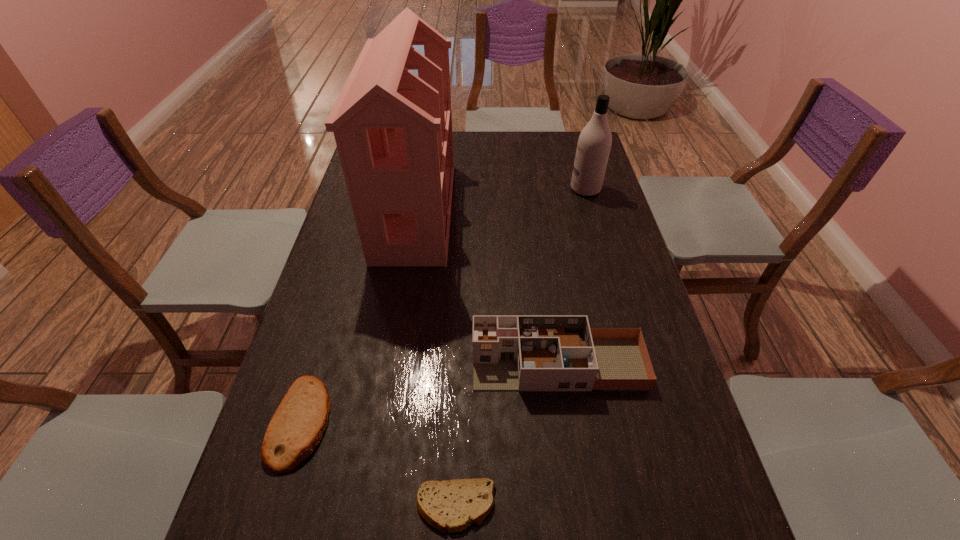
I want to click on shampoo at the right edge, so click(594, 143).

You are a GUI agent. You are given a task and a screenshot of the screen. Output one action in this format:
    pyautogui.click(x=<x>, y=<y>)
    Task: Click on the dollhouse that is at the right edge
    This screenshot has width=960, height=540.
    Given the screenshot: What is the action you would take?
    pyautogui.click(x=510, y=352)

Find the location of a particular element. This screenshot has height=540, width=960. vacant space at the left edge of the desktop is located at coordinates (327, 484).

This screenshot has width=960, height=540. Find the location of `free space at the right edge of the desktop`. free space at the right edge of the desktop is located at coordinates (646, 343).

Image resolution: width=960 pixels, height=540 pixels. Find the location of `vacant space that is in between the nearer dollhouse and the tallest object`. vacant space that is in between the nearer dollhouse and the tallest object is located at coordinates (487, 287).

Locate an element on the screen. This screenshot has height=540, width=960. free spot between the second tallest object and the right dollhouse is located at coordinates (572, 276).

What are the coordinates of `vacant area that lies between the shorter dollhouse and the tallest object` in the screenshot? It's located at (487, 287).

Where is `free space that is in between the fourth tallest object and the third tallest object`? This screenshot has height=540, width=960. free space that is in between the fourth tallest object and the third tallest object is located at coordinates (430, 393).

Identify the location of free area in between the right pita bread and the tallest object. (436, 359).

I want to click on free space between the nearer pita bread and the farther pita bread, so click(x=378, y=464).